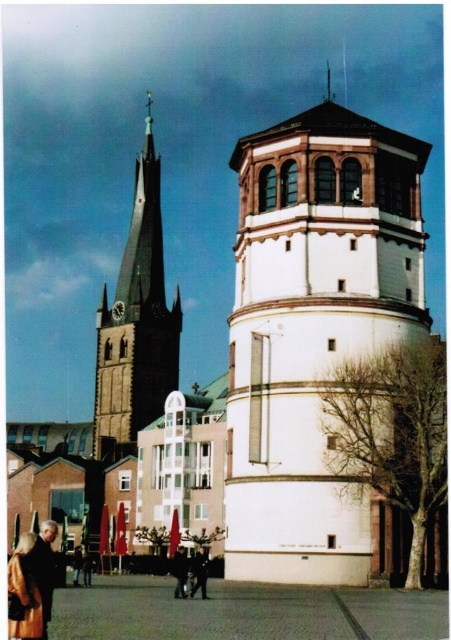
From the picture: You are a fashion designer looking to create a new outfit. You have a dark brown leather jacket at lower center and dark blue jeans at center. Which item would you choose if you want to emphasize a larger silhouette?

The dark brown leather jacket at lower center is larger in size than the dark blue jeans at center, so choosing the dark brown leather jacket at lower center would better emphasize a larger silhouette.

Looking at this image, you are standing in the urban scene and want to take a photo of the dark brown leather jacket at lower center. Your camera is 35.47 meters away from the jacket. Is the distance within the camera autofocus range of 30 meters?

The dark brown leather jacket at lower center and camera are 35.47 meters apart, which exceeds the camera autofocus range of 30 meters. Therefore, the camera cannot autofocus on the jacket at this distance.